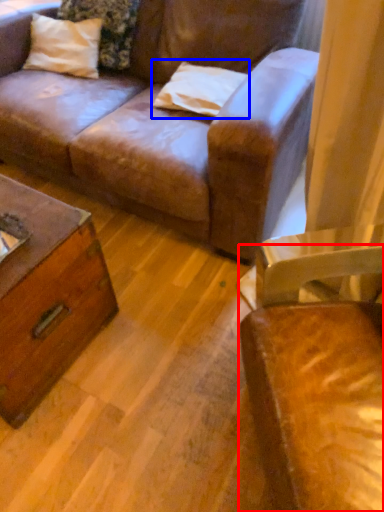
Question: Which point is further to the camera, chair (highlighted by a red box) or pillow (highlighted by a blue box)?

Choices:
 (A) chair
 (B) pillow

Answer: (B)